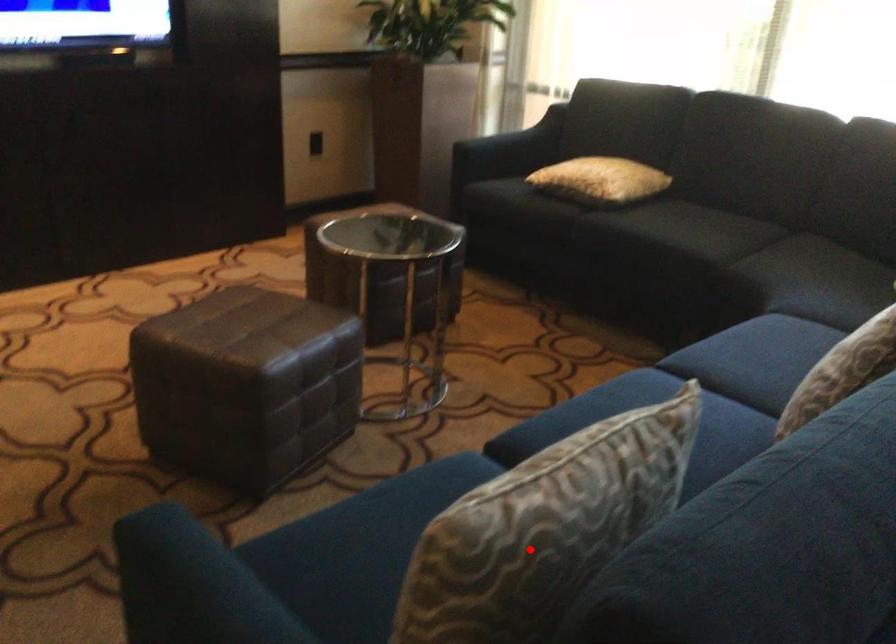
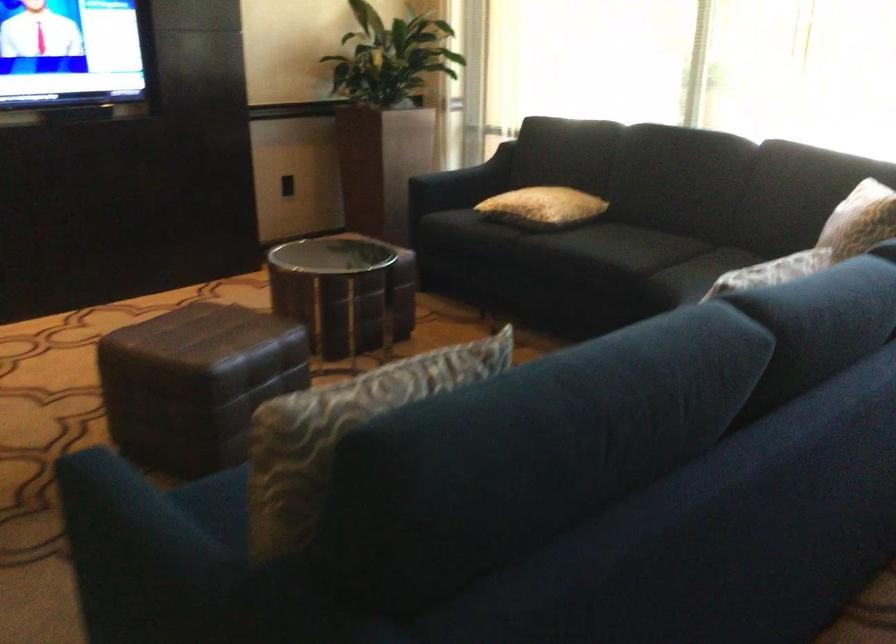
Question: I am providing you with two images of the same scene from different viewpoints. A red point is shown in image1. For the corresponding object point in image2, is it positioned nearer or farther from the camera?

Choices:
 (A) Nearer
 (B) Farther

Answer: (B)